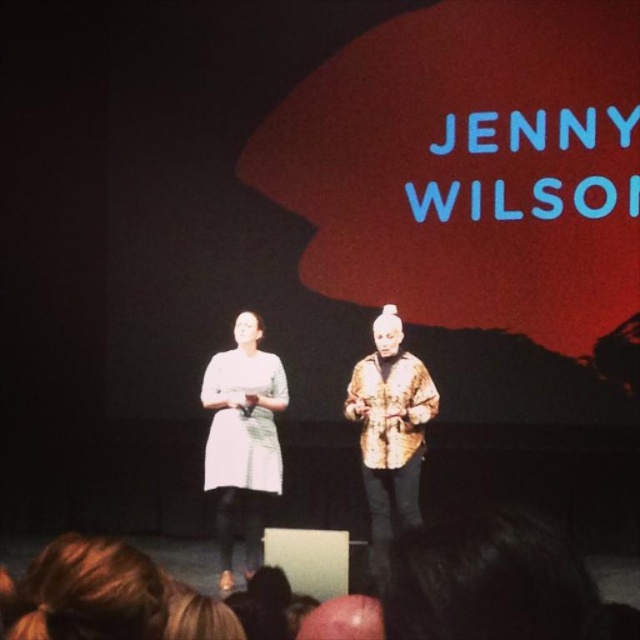
You are a photographer positioned at the camera. You want to capture a closeup shot of the matte white dress at center. Given that your camera can focus on subjects within 15 feet, will you be able to achieve this without moving closer?

The matte white dress at center is 18.04 feet away from the camera, which is beyond the 15 feet focus range. Therefore, you cannot capture a clear closeup without moving closer.